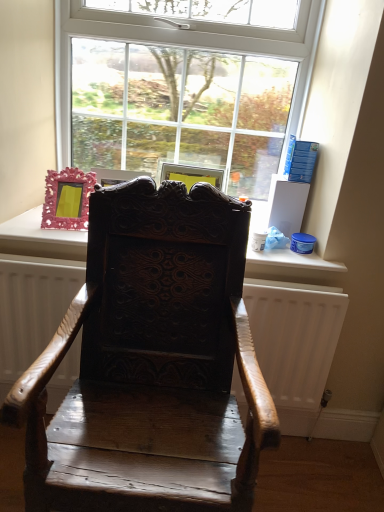
Question: Can you confirm if dark wood carved chair at center is wider than wooden radiator at center?

Choices:
 (A) yes
 (B) no

Answer: (A)

Question: Is wooden radiator at center a part of dark wood carved chair at center?

Choices:
 (A) no
 (B) yes

Answer: (A)

Question: Is dark wood carved chair at center not near wooden radiator at center?

Choices:
 (A) yes
 (B) no

Answer: (B)

Question: From the image's perspective, is dark wood carved chair at center located above wooden radiator at center?

Choices:
 (A) yes
 (B) no

Answer: (A)

Question: From the image's perspective, is dark wood carved chair at center below wooden radiator at center?

Choices:
 (A) no
 (B) yes

Answer: (A)

Question: Can you confirm if dark wood carved chair at center is bigger than wooden radiator at center?

Choices:
 (A) no
 (B) yes

Answer: (B)

Question: Considering the relative sizes of wooden radiator at center and clear glass window at upper center in the image provided, is wooden radiator at center shorter than clear glass window at upper center?

Choices:
 (A) no
 (B) yes

Answer: (B)

Question: From a real-world perspective, is wooden radiator at center positioned over clear glass window at upper center based on gravity?

Choices:
 (A) yes
 (B) no

Answer: (B)

Question: Is wooden radiator at center in front of clear glass window at upper center?

Choices:
 (A) no
 (B) yes

Answer: (B)

Question: Is wooden radiator at center facing away from clear glass window at upper center?

Choices:
 (A) yes
 (B) no

Answer: (B)

Question: Does wooden radiator at center turn towards clear glass window at upper center?

Choices:
 (A) no
 (B) yes

Answer: (A)

Question: From a real-world perspective, is wooden radiator at center positioned under clear glass window at upper center based on gravity?

Choices:
 (A) yes
 (B) no

Answer: (A)

Question: Considering the relative sizes of clear glass window at upper center and dark wood carved chair at center in the image provided, is clear glass window at upper center taller than dark wood carved chair at center?

Choices:
 (A) no
 (B) yes

Answer: (A)